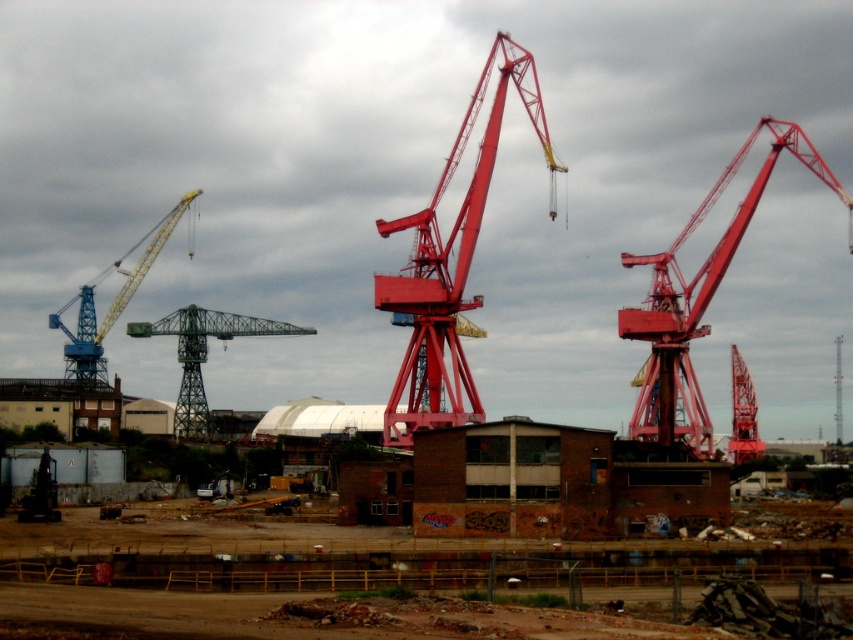
You are an engineer inspecting the industrial site. You notice two cranes labeled as the metallic red crane at right and the matte red crane at right. Which one reaches higher into the cloudy sky?

The metallic red crane at right is much taller than the matte red crane at right, so it reaches higher into the cloudy sky.

You are a construction worker planning to lift a heavy load using the metallic red crane at center and the green metallic crane at center. Which crane should you choose if you need the larger one for the task?

The metallic red crane at center is bigger than the green metallic crane at center, so you should choose the metallic red crane at center for lifting the heavy load.

Based on the photo, you are an engineer inspecting the construction site. You notice two cranes at the center of the scene. Which crane is positioned higher in the air, the metallic red crane at center or the green metallic crane at center?

The metallic red crane at center is positioned higher in the air than the green metallic crane at center because it is above the green metallic crane at center.